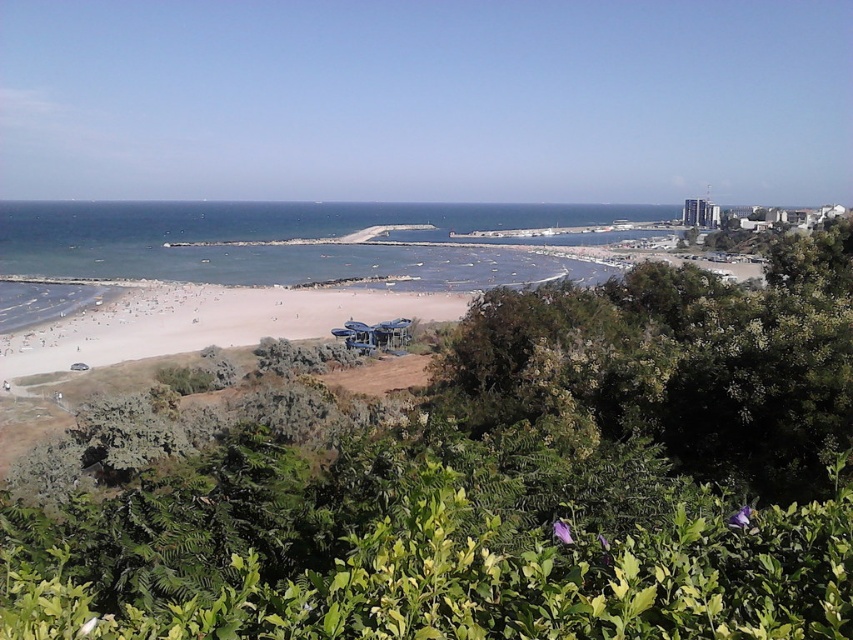
You are standing on the light beige sand at center and want to reach the blue water at center. Which direction should you move to get there?

Since the blue water at center is above the light beige sand at center, you should move upward to reach the blue water at center from the light beige sand at center.

You are planning to build a small sandcastle on the beach. Considering the positions of the blue water at center and the light beige sand at center, which area would be more suitable for building the sandcastle without it getting washed away by the water?

The light beige sand at center is more suitable for building the sandcastle because it is located away from the blue water at center, reducing the risk of the water washing it away.